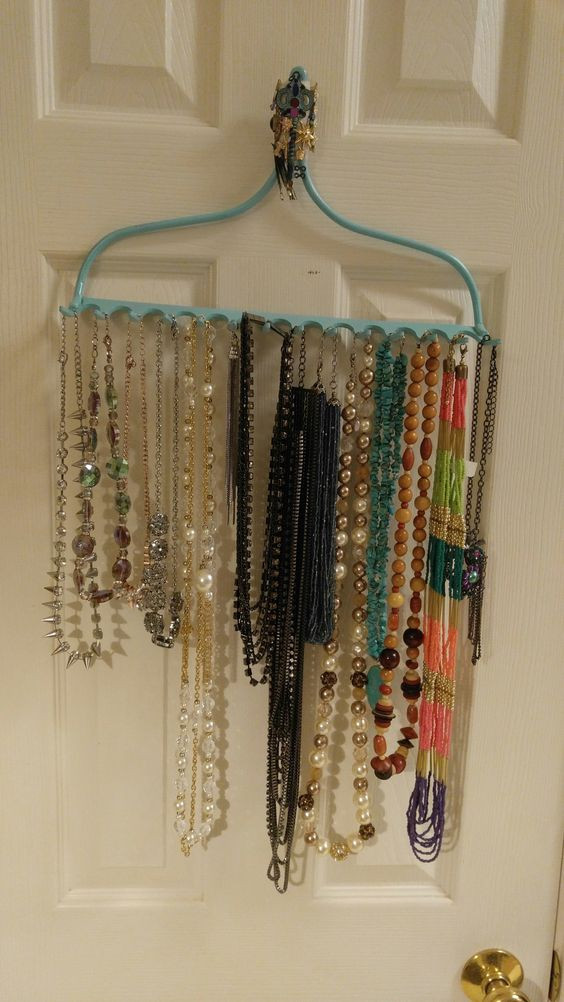
Image resolution: width=564 pixels, height=1002 pixels. Find the location of `hook to hang necklace on`. hook to hang necklace on is located at coordinates click(x=65, y=314).